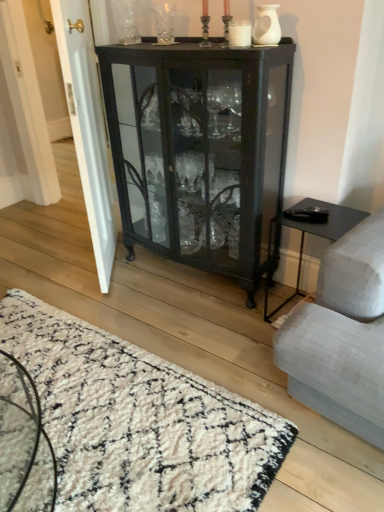
I want to click on vacant point to the left of white glossy door at left, so click(49, 260).